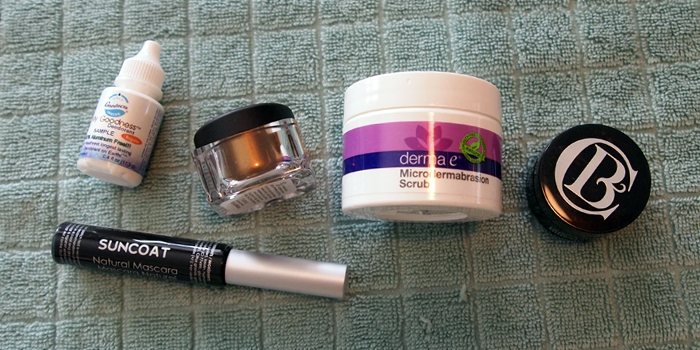
You are a GUI agent. You are given a task and a screenshot of the screen. Output one action in this format:
    pyautogui.click(x=<x>, y=<y>)
    Task: Click on the light reflections
    The image size is (700, 350).
    Given the screenshot: What is the action you would take?
    pyautogui.click(x=428, y=189), pyautogui.click(x=554, y=205), pyautogui.click(x=154, y=240)